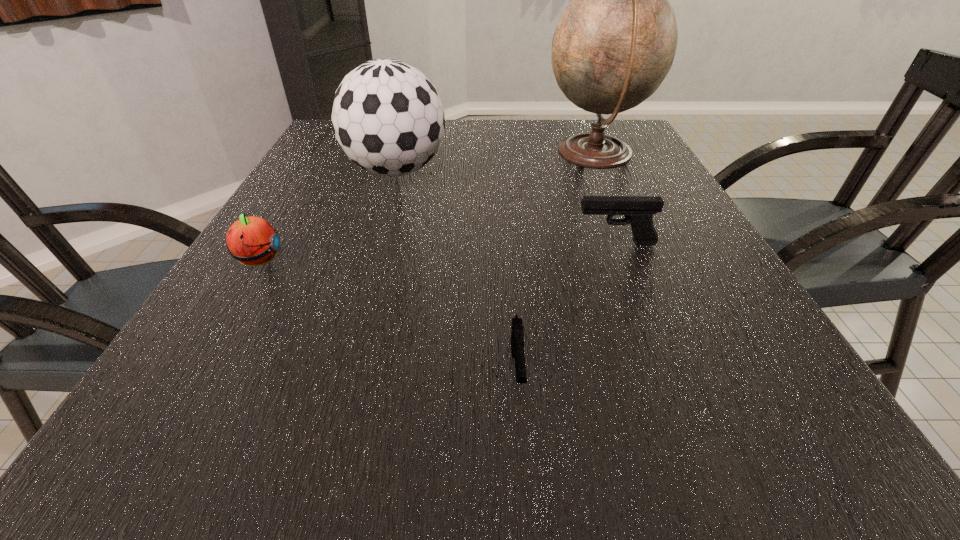
Find the location of `free space located 0.370m on the front-facing side of the tallest object`. free space located 0.370m on the front-facing side of the tallest object is located at coordinates (403, 156).

What are the coordinates of `vacant space located 0.400m on the right of the fourth object from right to left` in the screenshot? It's located at (607, 171).

You are a GUI agent. You are given a task and a screenshot of the screen. Output one action in this format:
    pyautogui.click(x=<x>, y=<y>)
    Task: Click on the free location located on the front-facing side of the farther pistol
    The width and height of the screenshot is (960, 540).
    Given the screenshot: What is the action you would take?
    pyautogui.click(x=484, y=243)

Where is `free space located 0.270m on the front-facing side of the farther pistol`? free space located 0.270m on the front-facing side of the farther pistol is located at coordinates (439, 243).

Where is `vacant space situated 0.200m on the front-facing side of the farther pistol`? This screenshot has height=540, width=960. vacant space situated 0.200m on the front-facing side of the farther pistol is located at coordinates (474, 243).

What are the coordinates of `vacant space located on the front of the leftmost object` in the screenshot? It's located at (146, 450).

This screenshot has height=540, width=960. Identify the location of globe present at the far edge. (615, 43).

You are a GUI agent. You are given a task and a screenshot of the screen. Output one action in this format:
    pyautogui.click(x=<x>, y=<y>)
    Task: Click on the soccer ball that is at the far edge
    Image resolution: width=960 pixels, height=540 pixels.
    Given the screenshot: What is the action you would take?
    pyautogui.click(x=387, y=116)

Locate an element on the screen. The height and width of the screenshot is (540, 960). object that is at the near edge is located at coordinates (517, 338).

At what (x,y) coordinates should I click in order to perform the action: click on soccer ball that is at the left edge. Please return your answer as a coordinate pair (x, y). This screenshot has width=960, height=540. Looking at the image, I should click on (387, 116).